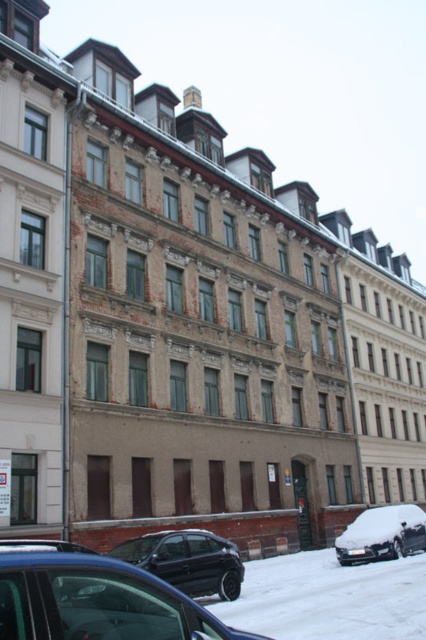
Question: Which point is farther from the camera taking this photo?

Choices:
 (A) (365, 547)
 (B) (143, 540)
 (C) (144, 589)

Answer: (A)

Question: Does shiny black sedan at lower left come behind snow-covered car at lower right?

Choices:
 (A) no
 (B) yes

Answer: (A)

Question: Among these points, which one is farthest from the camera?

Choices:
 (A) (236, 556)
 (B) (60, 608)
 (C) (396, 554)

Answer: (C)

Question: Does shiny black car at lower left appear on the left side of snow-covered car at lower right?

Choices:
 (A) no
 (B) yes

Answer: (B)

Question: Which of the following is the farthest from the observer?

Choices:
 (A) snow-covered car at lower right
 (B) shiny black car at lower left

Answer: (A)

Question: Is shiny black car at lower left bigger than shiny black sedan at lower left?

Choices:
 (A) yes
 (B) no

Answer: (A)